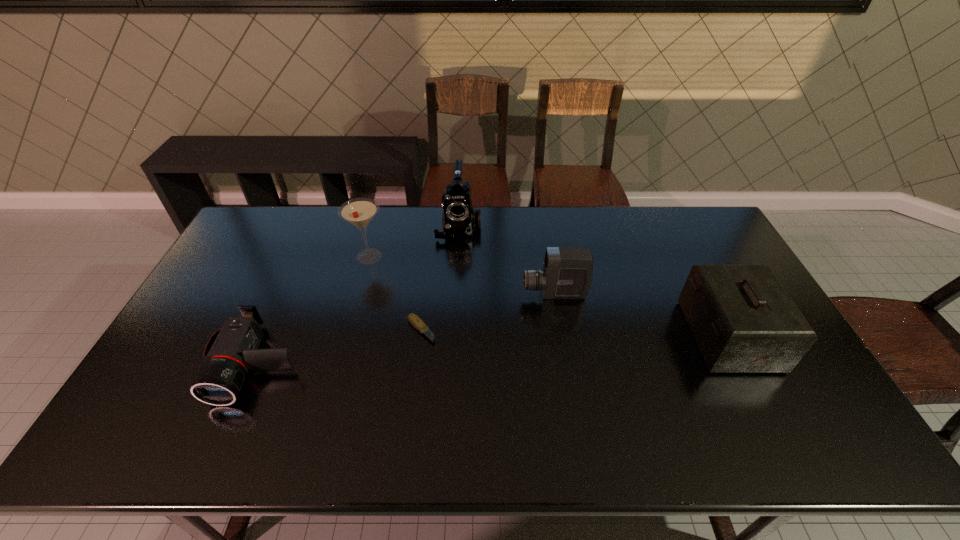
You are a GUI agent. You are given a task and a screenshot of the screen. Output one action in this format:
    pyautogui.click(x=<x>, y=<y>)
    Task: Click on the farthest object
    The image size is (960, 540).
    Given the screenshot: What is the action you would take?
    pyautogui.click(x=459, y=218)

This screenshot has width=960, height=540. In order to click on the farthest camcorder in this screenshot , I will do `click(459, 218)`.

Locate an element on the screen. the second farthest object is located at coordinates (359, 212).

At what (x,y) coordinates should I click in order to perform the action: click on martini. Please return your answer as a coordinate pair (x, y). This screenshot has width=960, height=540. Looking at the image, I should click on (359, 212).

What are the coordinates of `the rightmost object` in the screenshot? It's located at (743, 321).

You are a GUI agent. You are given a task and a screenshot of the screen. Output one action in this format:
    pyautogui.click(x=<x>, y=<y>)
    Task: Click on the second shortest camcorder
    The image size is (960, 540).
    Given the screenshot: What is the action you would take?
    tap(567, 272)

Where is `the second object from right to left`? The width and height of the screenshot is (960, 540). the second object from right to left is located at coordinates [567, 272].

The height and width of the screenshot is (540, 960). Find the location of `the leftmost camcorder`. the leftmost camcorder is located at coordinates (232, 351).

The height and width of the screenshot is (540, 960). Find the location of `the shortest camcorder`. the shortest camcorder is located at coordinates (232, 351).

Locate an element on the screen. This screenshot has width=960, height=540. the shortest object is located at coordinates (416, 321).